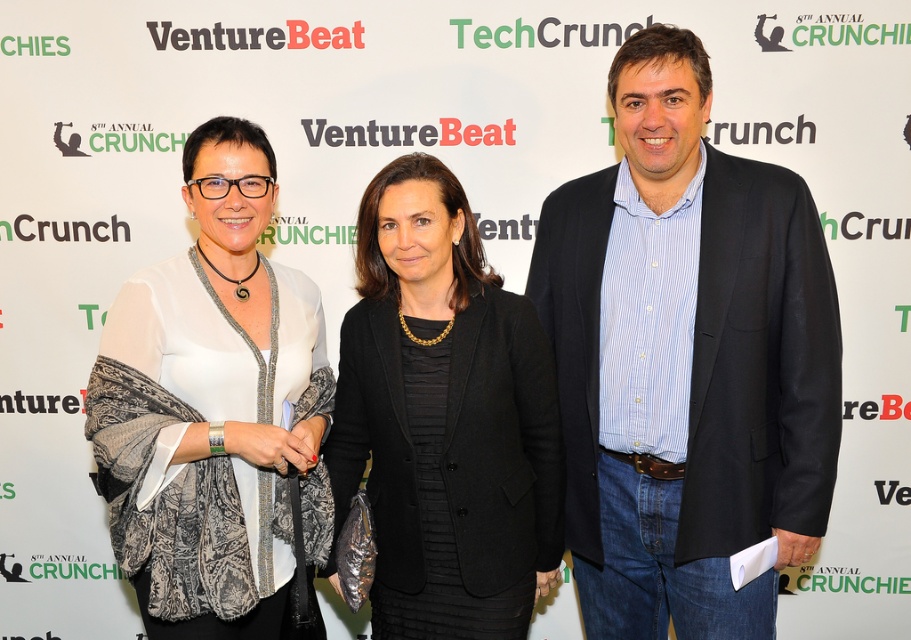
Question: Which object appears closest to the camera in this image?

Choices:
 (A) blue striped shirt at center
 (B) black textured blazer at center

Answer: (B)

Question: Is the position of blue striped shirt at center less distant than that of black textured blazer at center?

Choices:
 (A) yes
 (B) no

Answer: (B)

Question: Is blue striped shirt at center behind white sheer blouse at center?

Choices:
 (A) no
 (B) yes

Answer: (B)

Question: Which point is closer to the camera taking this photo?

Choices:
 (A) pos(724,321)
 (B) pos(408,182)
 (C) pos(254,452)

Answer: (C)

Question: Is white sheer blouse at center to the right of black textured blazer at center from the viewer's perspective?

Choices:
 (A) yes
 (B) no

Answer: (B)

Question: Which point is farther to the camera?

Choices:
 (A) (828, 268)
 (B) (525, 560)
 (C) (236, 435)

Answer: (B)